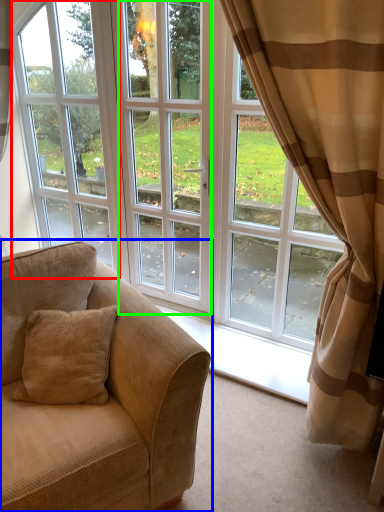
Question: Which is nearer to the window frame (highlighted by a red box)? studio couch (highlighted by a blue box) or screen door (highlighted by a green box).

Choices:
 (A) studio couch
 (B) screen door

Answer: (B)